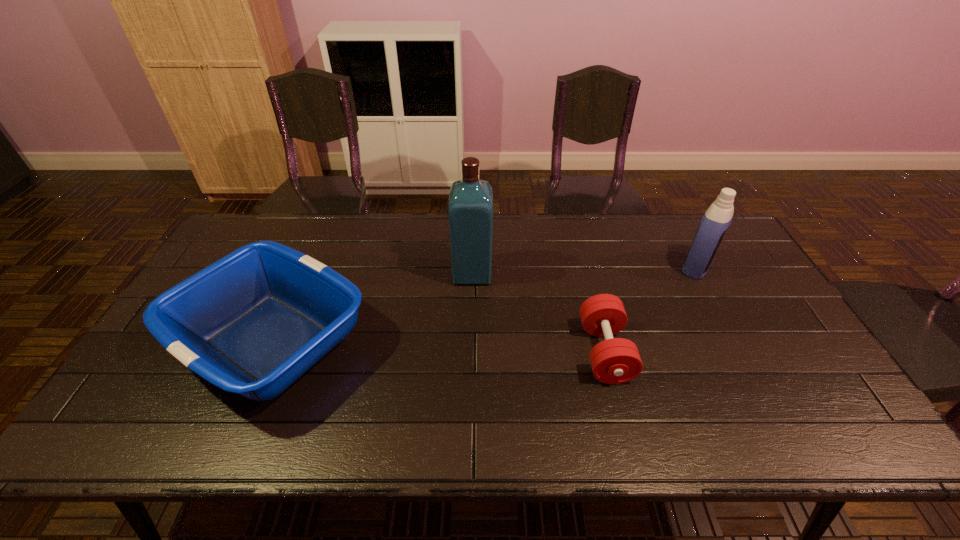
Locate an element on the screen. The height and width of the screenshot is (540, 960). liquor is located at coordinates (470, 208).

At what (x,y) coordinates should I click in order to perform the action: click on the third object from right to left. Please return your answer as a coordinate pair (x, y). The image size is (960, 540). Looking at the image, I should click on (470, 208).

Identify the location of the third shortest object. (718, 217).

Locate an element on the screen. This screenshot has width=960, height=540. detergent is located at coordinates (718, 217).

This screenshot has height=540, width=960. Identify the location of tray. (253, 322).

Where is `the leftmost object`? This screenshot has height=540, width=960. the leftmost object is located at coordinates (253, 322).

At what (x,y) coordinates should I click in order to perform the action: click on the second object from right to left. Please return your answer as a coordinate pair (x, y). This screenshot has height=540, width=960. Looking at the image, I should click on (615, 360).

Where is `dumbbell`? The height and width of the screenshot is (540, 960). dumbbell is located at coordinates (615, 360).

Locate an element on the screen. This screenshot has height=540, width=960. free space located 0.340m on the flat label side of the tallest object is located at coordinates (599, 273).

Locate an element on the screen. Image resolution: width=960 pixels, height=540 pixels. vacant space located 0.200m on the front of the rightmost object is located at coordinates (732, 332).